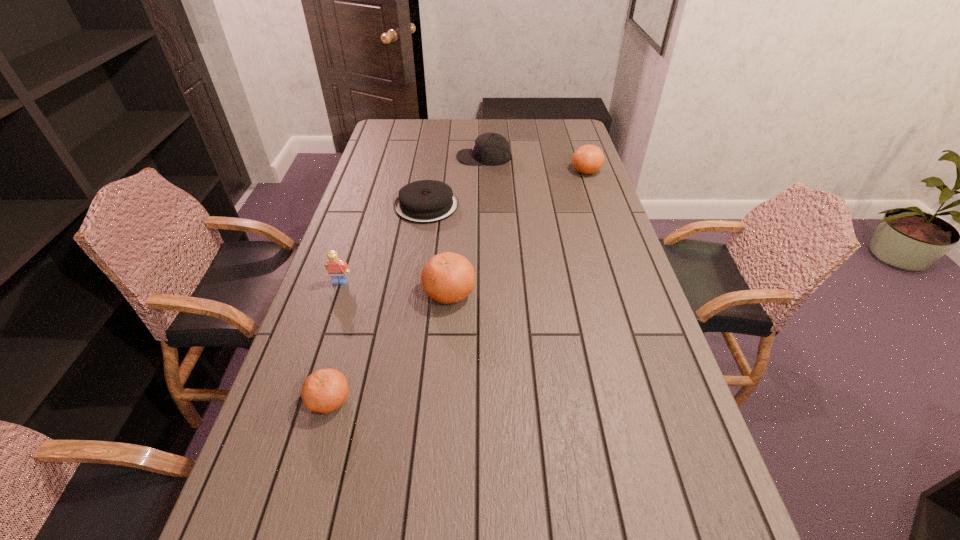
The image size is (960, 540). I want to click on blank area located on the right of the nearest object, so click(x=404, y=400).

Where is `vacant space situated on the back of the second farthest clementine`? The image size is (960, 540). vacant space situated on the back of the second farthest clementine is located at coordinates (453, 232).

The width and height of the screenshot is (960, 540). I want to click on vacant point located on the left of the rightmost object, so click(548, 171).

I want to click on free location located 0.280m on the front-facing side of the cap, so click(390, 157).

Find the location of `vacant region located on the front-facing side of the cap`. vacant region located on the front-facing side of the cap is located at coordinates (414, 157).

Where is `free space located on the front-facing side of the cap`? Image resolution: width=960 pixels, height=540 pixels. free space located on the front-facing side of the cap is located at coordinates (435, 157).

Where is `blank space located on the right of the fourth nearest object`? blank space located on the right of the fourth nearest object is located at coordinates (475, 206).

Find the location of a particular element. vacant space located 0.130m on the front-facing side of the Lego is located at coordinates (327, 319).

Find the location of a particular element. This screenshot has width=960, height=540. clementine located at the left edge is located at coordinates (325, 390).

At what (x,y) coordinates should I click in order to perform the action: click on pancake present at the left edge. Please return your answer as a coordinate pair (x, y). This screenshot has width=960, height=540. Looking at the image, I should click on (426, 201).